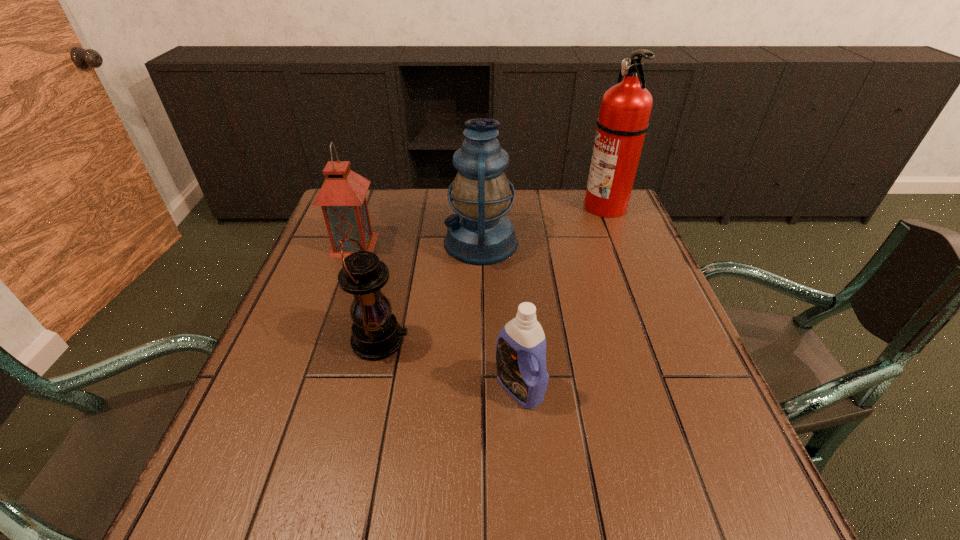
Find the location of `the tallest object`. the tallest object is located at coordinates (625, 110).

Where is `the rightmost object`? This screenshot has height=540, width=960. the rightmost object is located at coordinates (625, 110).

You are a GUI agent. You are given a task and a screenshot of the screen. Output one action in this format:
    pyautogui.click(x=<x>, y=<y>)
    Task: Click on the rightmost lantern
    The width and height of the screenshot is (960, 540).
    Given the screenshot: What is the action you would take?
    pyautogui.click(x=480, y=233)

At what (x,y) coordinates should I click in order to perform the action: click on the leftmost lantern. Please return your answer as a coordinate pair (x, y). The height and width of the screenshot is (540, 960). Looking at the image, I should click on (342, 197).

Identify the location of the second object from left to right. (376, 334).

Locate an element on the screen. the second lantern from left to right is located at coordinates (376, 334).

Find the location of `the nearest object`. the nearest object is located at coordinates (521, 344).

Where is `the shortest object`? Image resolution: width=960 pixels, height=540 pixels. the shortest object is located at coordinates (521, 344).

Find the location of a particular element. vacant region located at the nozzle of the rightmost object is located at coordinates (554, 206).

Where is `free region located 0.170m at the nozzle of the rightmost object`? The image size is (960, 540). free region located 0.170m at the nozzle of the rightmost object is located at coordinates (527, 206).